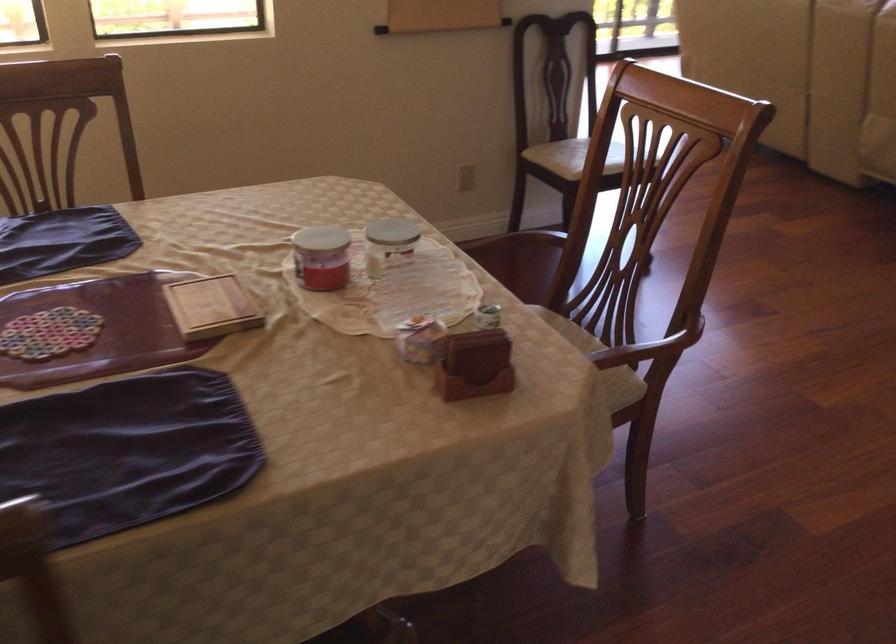
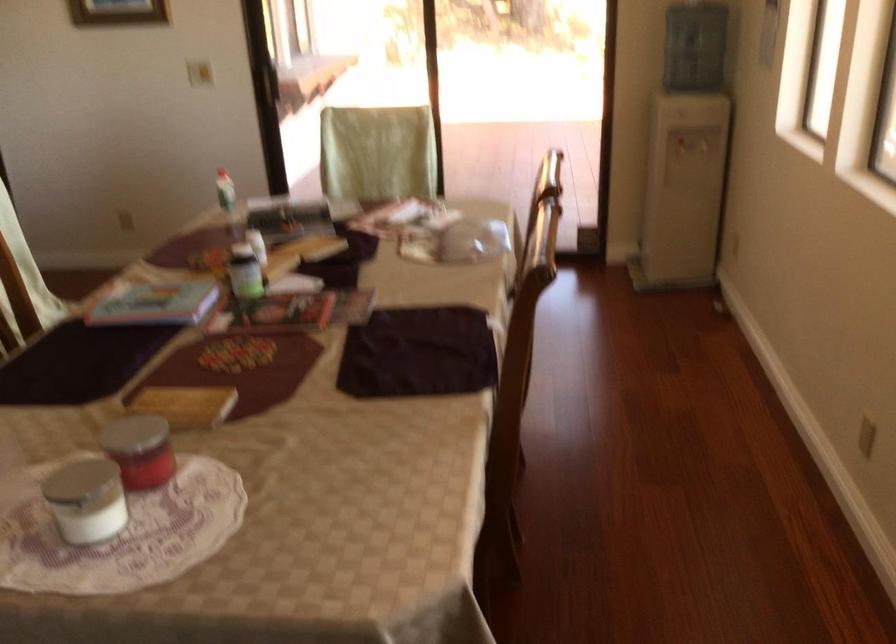
The point at (407, 232) is marked in the first image. Where is the corresponding point in the second image?

(85, 500)